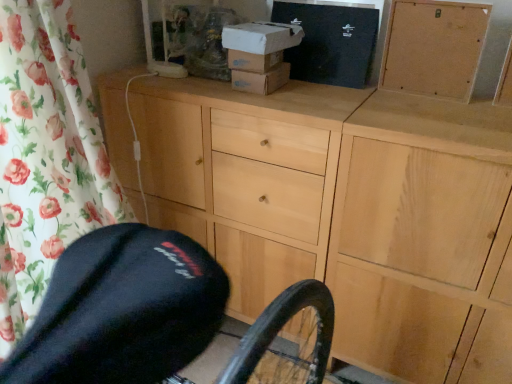
Question: From the image's perspective, is black cardboard box at upper center, marked as the 1th box in a right-to-left arrangement, below light wood cabinet at center?

Choices:
 (A) no
 (B) yes

Answer: (A)

Question: Is light wood cabinet at center completely or partially inside black cardboard box at upper center, marked as the 1th box in a right-to-left arrangement?

Choices:
 (A) yes
 (B) no

Answer: (B)

Question: From a real-world perspective, is black cardboard box at upper center, marked as the 1th box in a right-to-left arrangement, beneath light wood cabinet at center?

Choices:
 (A) yes
 (B) no

Answer: (B)

Question: Does black cardboard box at upper center, marked as the 1th box in a right-to-left arrangement, have a smaller size compared to light wood cabinet at center?

Choices:
 (A) yes
 (B) no

Answer: (A)

Question: Does black cardboard box at upper center, which ranks as the second box in left-to-right order, lie behind light wood cabinet at center?

Choices:
 (A) no
 (B) yes

Answer: (B)

Question: From the image's perspective, relative to white cardboard box at upper center, the second box when ordered from right to left, is corkboard at upper right above or below?

Choices:
 (A) above
 (B) below

Answer: (B)

Question: From a real-world perspective, is corkboard at upper right positioned above or below white cardboard box at upper center, the second box when ordered from right to left?

Choices:
 (A) above
 (B) below

Answer: (A)

Question: In terms of width, does corkboard at upper right look wider or thinner when compared to white cardboard box at upper center, marked as the 1th box in a left-to-right arrangement?

Choices:
 (A) wide
 (B) thin

Answer: (B)

Question: Considering the positions of point (445, 51) and point (245, 36), is point (445, 51) closer or farther from the camera than point (245, 36)?

Choices:
 (A) closer
 (B) farther

Answer: (A)

Question: From a real-world perspective, is white cardboard box at upper center, marked as the 1th box in a left-to-right arrangement, above or below light wood cabinet at center?

Choices:
 (A) below
 (B) above

Answer: (B)

Question: Would you say white cardboard box at upper center, marked as the 1th box in a left-to-right arrangement, is inside or outside light wood cabinet at center?

Choices:
 (A) outside
 (B) inside

Answer: (A)

Question: Considering the positions of white cardboard box at upper center, marked as the 1th box in a left-to-right arrangement, and light wood cabinet at center in the image, is white cardboard box at upper center, marked as the 1th box in a left-to-right arrangement, bigger or smaller than light wood cabinet at center?

Choices:
 (A) big
 (B) small

Answer: (B)

Question: Considering the positions of white cardboard box at upper center, the second box when ordered from right to left, and light wood cabinet at center in the image, is white cardboard box at upper center, the second box when ordered from right to left, taller or shorter than light wood cabinet at center?

Choices:
 (A) tall
 (B) short

Answer: (B)

Question: From a real-world perspective, is light wood cabinet at center above or below corkboard at upper right?

Choices:
 (A) below
 (B) above

Answer: (A)

Question: Considering the positions of point (264, 188) and point (436, 81), is point (264, 188) closer or farther from the camera than point (436, 81)?

Choices:
 (A) farther
 (B) closer

Answer: (A)